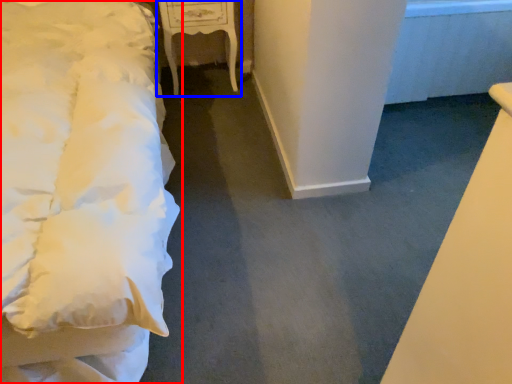
Question: Among these objects, which one is farthest to the camera, bed (highlighted by a red box) or furniture (highlighted by a blue box)?

Choices:
 (A) bed
 (B) furniture

Answer: (B)